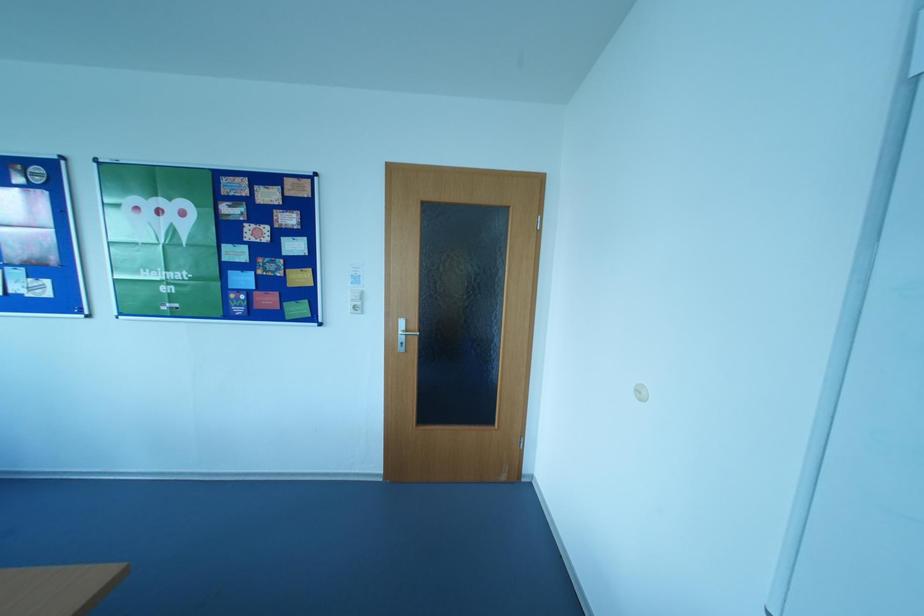
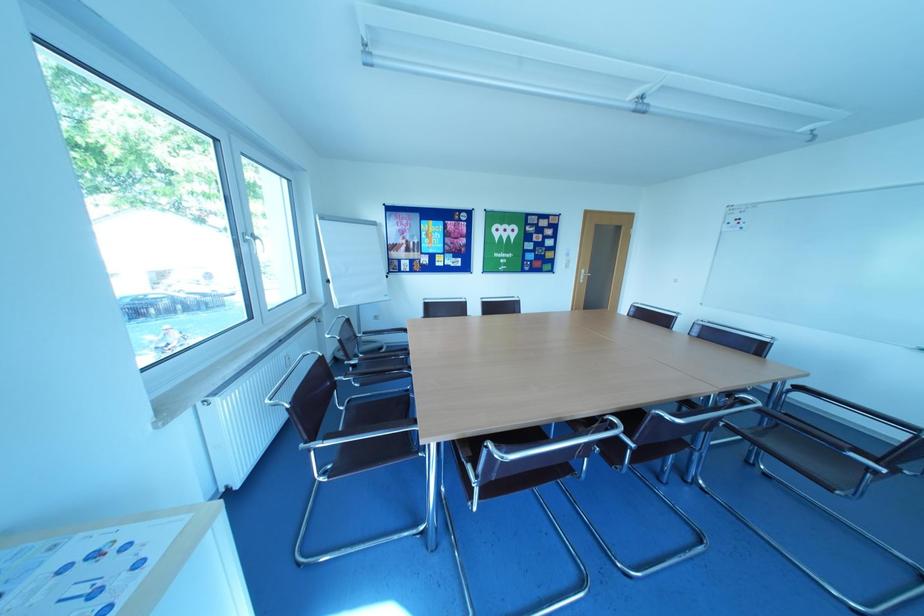
Based on the photo, what movement of the cameraman would produce the second image?

The cameraman walked toward left, backward.